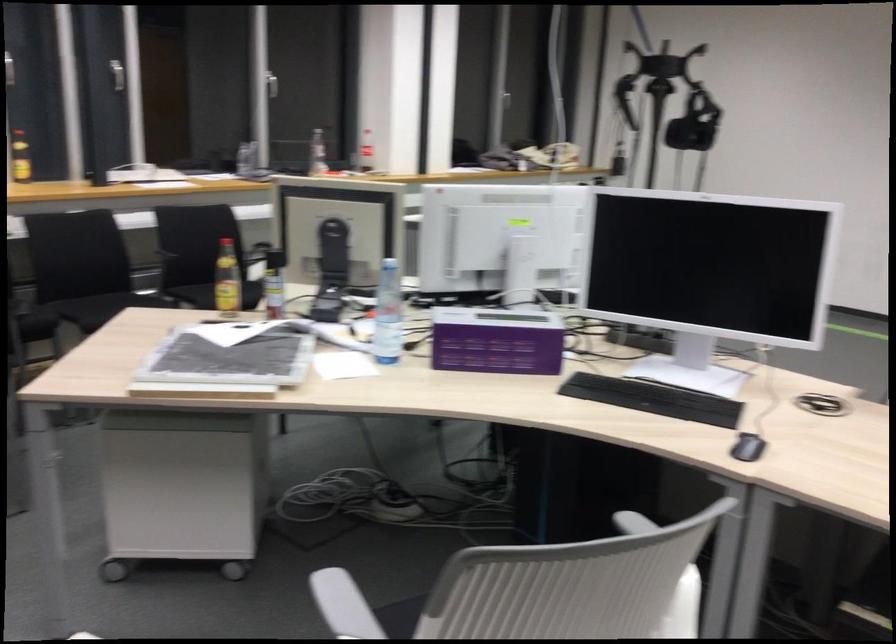
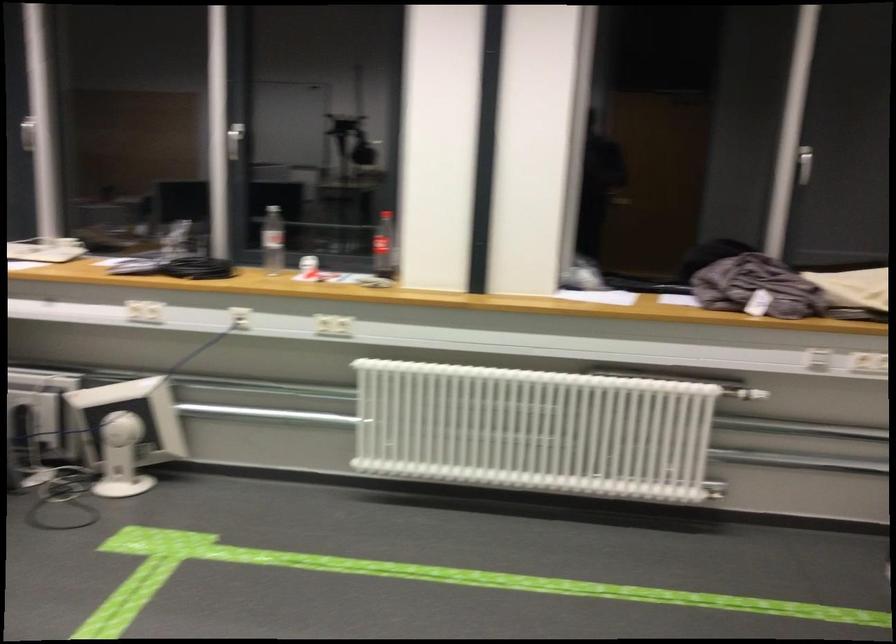
The point at (254, 80) is marked in the first image. Where is the corresponding point in the second image?

(235, 140)